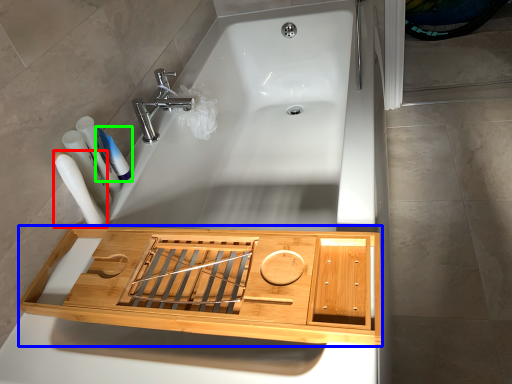
Question: Estimate the real-world distances between objects in this image. Which object is closer to toiletry (highlighted by a red box), cabinetry (highlighted by a blue box) or toothpaste (highlighted by a green box)?

Choices:
 (A) cabinetry
 (B) toothpaste

Answer: (B)